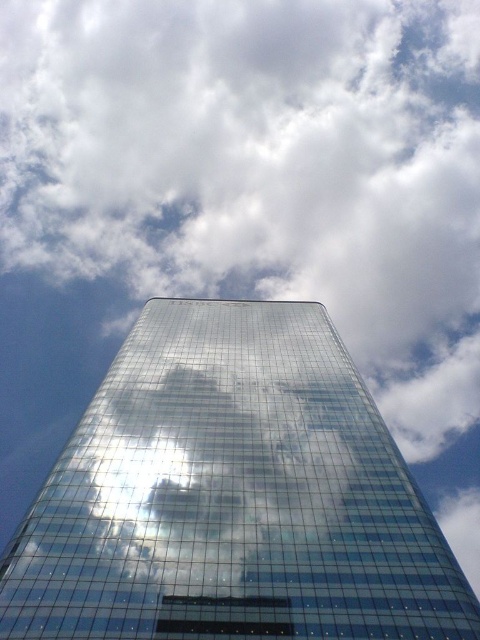
You are standing in front of the HSBC skyscraper and notice two points on its glass facade. The first point is located at coordinates point (101,508) and the second at point (178,545). Which point is closer to you?

Point (101,508) is further to the camera than point (178,545), so the point closer to you is point (178,545).

You are standing at a viewpoint 30 meters away from the transparent glass tower at center. Can you safely approach the tower to take a photo without getting too close?

The distance between you and the transparent glass tower at center is 33.97 meters. Since you are currently 30 meters away, you are already closer than the safe distance. To take a photo safely, you should move back to maintain at least 33.97 meters distance.

You are an architect reviewing a design blueprint. You notice two structures labeled as transparent glass tower at center and transparent glass building at center. According to the blueprint, which one is larger in size?

The transparent glass tower at center is bigger than transparent glass building at center, so the transparent glass tower at center is the larger one.